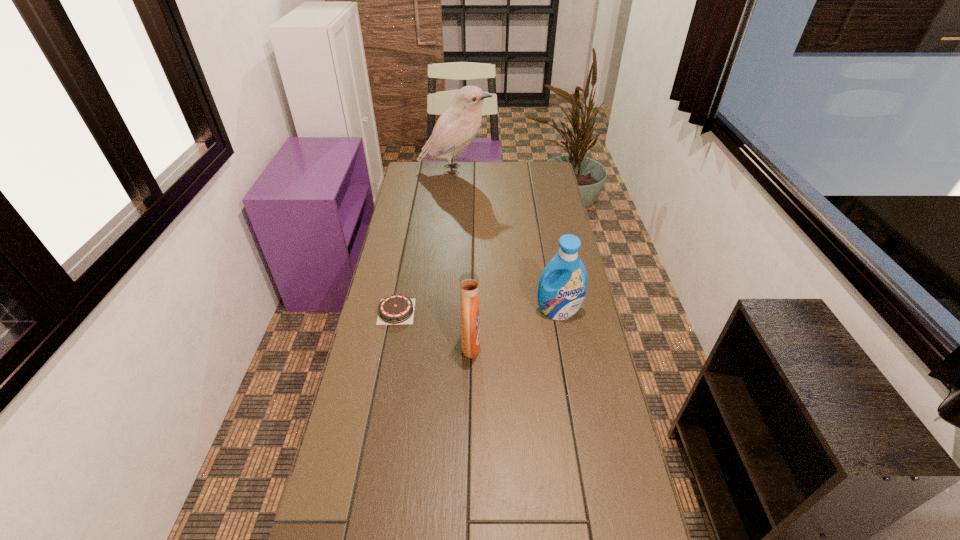
Where is `vacant space located 0.070m on the front of the chocolate cake`? This screenshot has height=540, width=960. vacant space located 0.070m on the front of the chocolate cake is located at coordinates (391, 341).

Find the location of a particular element. This screenshot has height=540, width=960. object at the far edge is located at coordinates (456, 128).

Identify the location of parakeet located in the left edge section of the desktop. click(x=456, y=128).

Identify the location of chocolate cake present at the left edge. pos(396,309).

Where is `object present at the right edge`? The height and width of the screenshot is (540, 960). object present at the right edge is located at coordinates (560, 296).

Where is `object at the far left corner`? This screenshot has height=540, width=960. object at the far left corner is located at coordinates (456, 128).

I want to click on vacant space at the far edge of the desktop, so click(x=518, y=161).

In the image, there is a desktop. At what (x,y) coordinates should I click in order to perform the action: click on vacant space at the left edge. Please return your answer as a coordinate pair (x, y). Looking at the image, I should click on (378, 401).

Identify the location of free location at the right edge of the desktop. The height and width of the screenshot is (540, 960). (573, 345).

The height and width of the screenshot is (540, 960). In the image, there is a desktop. What are the coordinates of `free space at the far right corner` in the screenshot? It's located at (529, 171).